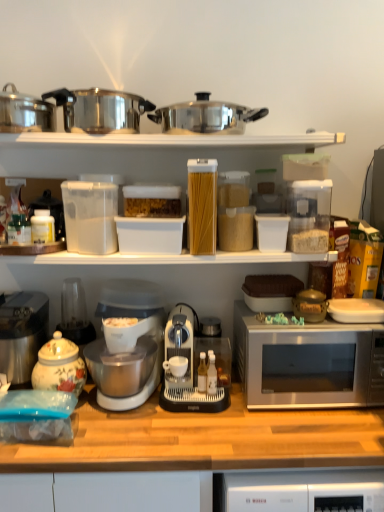
Question: Is porcelain floral tea pot at left located outside stainless steel coffee maker at left?

Choices:
 (A) yes
 (B) no

Answer: (A)

Question: Is porcelain floral tea pot at left at the right side of stainless steel coffee maker at left?

Choices:
 (A) yes
 (B) no

Answer: (A)

Question: Can stainless steel coffee maker at left be found inside porcelain floral tea pot at left?

Choices:
 (A) yes
 (B) no

Answer: (B)

Question: Is porcelain floral tea pot at left thinner than stainless steel coffee maker at left?

Choices:
 (A) no
 (B) yes

Answer: (B)

Question: Is porcelain floral tea pot at left further to the viewer compared to stainless steel coffee maker at left?

Choices:
 (A) yes
 (B) no

Answer: (B)

Question: From the image's perspective, is porcelain floral tea pot at left over stainless steel coffee maker at left?

Choices:
 (A) yes
 (B) no

Answer: (B)

Question: Considering the relative positions of translucent plastic container at center and satin silver microwave at right in the image provided, is translucent plastic container at center behind satin silver microwave at right?

Choices:
 (A) yes
 (B) no

Answer: (A)

Question: Would you say translucent plastic container at center is outside satin silver microwave at right?

Choices:
 (A) yes
 (B) no

Answer: (A)

Question: Is translucent plastic container at center placed right next to satin silver microwave at right?

Choices:
 (A) no
 (B) yes

Answer: (A)

Question: Is satin silver microwave at right at the back of translucent plastic container at center?

Choices:
 (A) no
 (B) yes

Answer: (A)

Question: Considering the relative sizes of translucent plastic container at center and satin silver microwave at right in the image provided, is translucent plastic container at center wider than satin silver microwave at right?

Choices:
 (A) no
 (B) yes

Answer: (A)

Question: Can you confirm if translucent plastic container at center is thinner than satin silver microwave at right?

Choices:
 (A) no
 (B) yes

Answer: (B)

Question: Is stainless steel coffee maker at left at the left side of white plastic coffee machine at center?

Choices:
 (A) yes
 (B) no

Answer: (A)